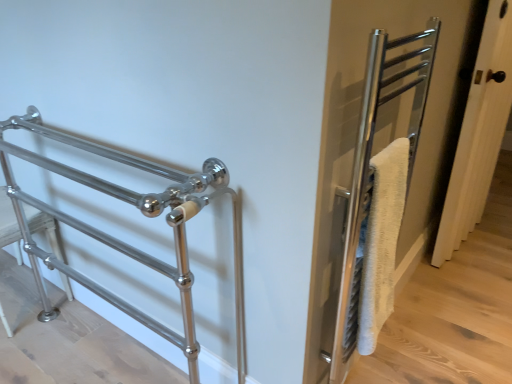
Question: In the image, is polished metal towel rack at left positioned in front of or behind white wood door at right?

Choices:
 (A) behind
 (B) front

Answer: (B)

Question: Based on their positions, is polished metal towel rack at left located to the left or right of white wood door at right?

Choices:
 (A) right
 (B) left

Answer: (B)

Question: Is polished metal towel rack at left taller or shorter than white wood door at right?

Choices:
 (A) tall
 (B) short

Answer: (B)

Question: Looking at the image, does white wood door at right seem bigger or smaller compared to polished metal towel rack at left?

Choices:
 (A) big
 (B) small

Answer: (B)

Question: From the image's perspective, is white wood door at right above or below polished metal towel rack at left?

Choices:
 (A) above
 (B) below

Answer: (A)

Question: Looking at their shapes, would you say white wood door at right is wider or thinner than polished metal towel rack at left?

Choices:
 (A) wide
 (B) thin

Answer: (B)

Question: From their relative heights in the image, would you say white wood door at right is taller or shorter than polished metal towel rack at left?

Choices:
 (A) short
 (B) tall

Answer: (B)